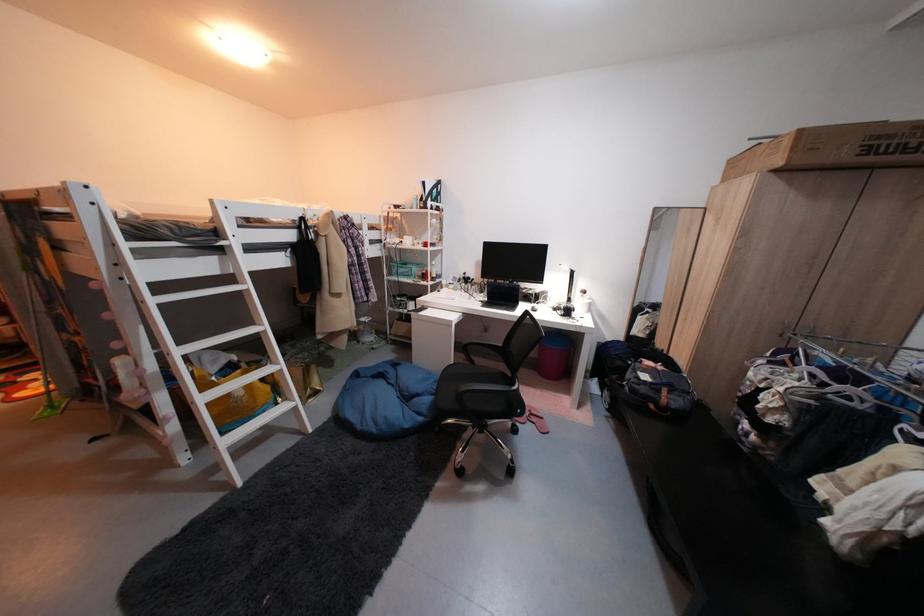
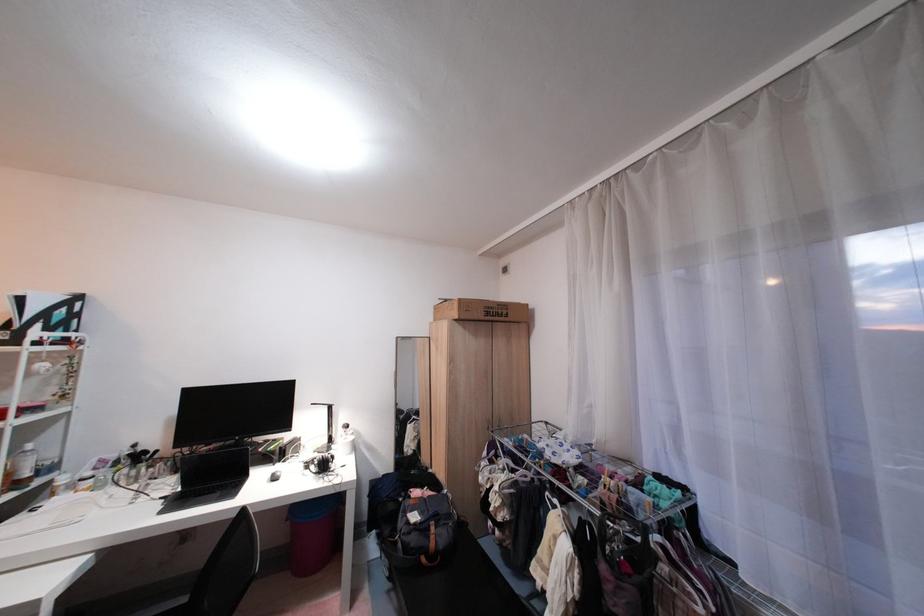
The point at (x=812, y=132) is marked in the first image. Where is the corresponding point in the second image?

(470, 302)